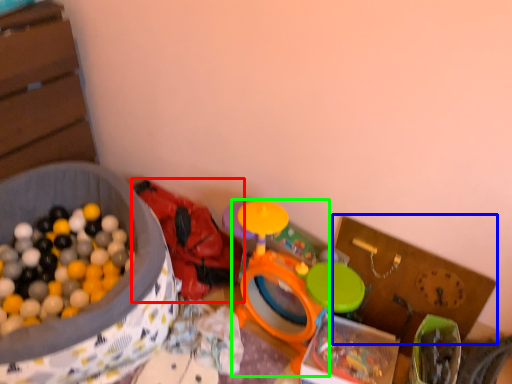
Question: Estimate the real-world distances between objects in this image. Which object is farther from toy (highlighted by a red box), cardboard box (highlighted by a blue box) or toy (highlighted by a green box)?

Choices:
 (A) cardboard box
 (B) toy

Answer: (A)